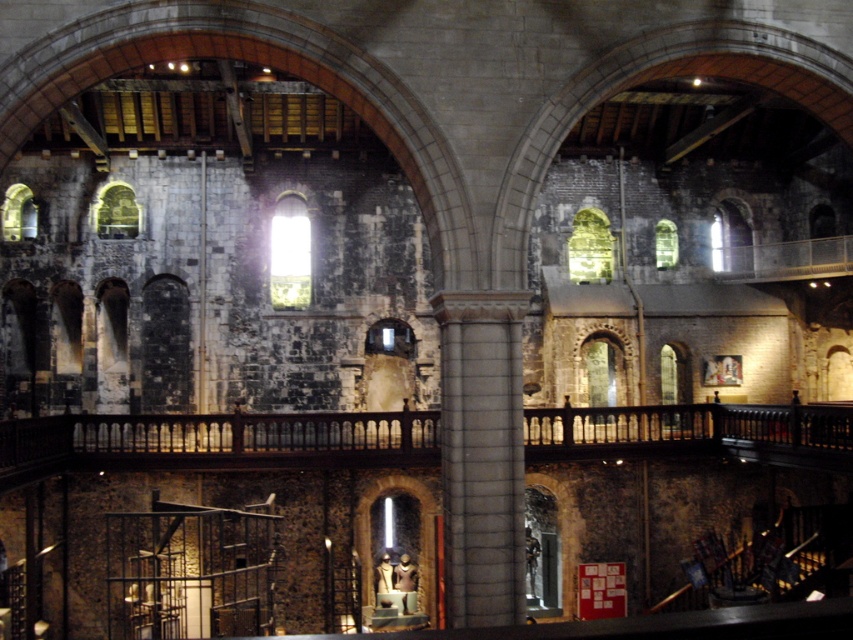
Question: Which of the following is the farthest from the observer?

Choices:
 (A) gray stone column at center
 (B) dark wood balustrade at center

Answer: (B)

Question: From the image, what is the correct spatial relationship of dark wood balustrade at center in relation to gray stone column at center?

Choices:
 (A) below
 (B) above

Answer: (B)

Question: Is dark wood balustrade at center to the left of gray stone column at center from the viewer's perspective?

Choices:
 (A) no
 (B) yes

Answer: (B)

Question: Can you confirm if dark wood balustrade at center is positioned above gray stone column at center?

Choices:
 (A) no
 (B) yes

Answer: (B)